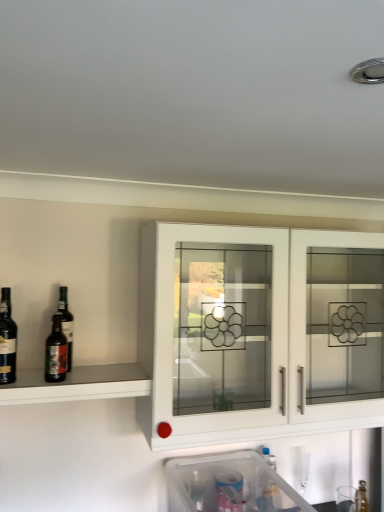
This screenshot has height=512, width=384. In order to click on free space to the right of dark brown glass bottle at left, which appears as the 2th wine when viewed from the right in this screenshot , I will do `click(44, 381)`.